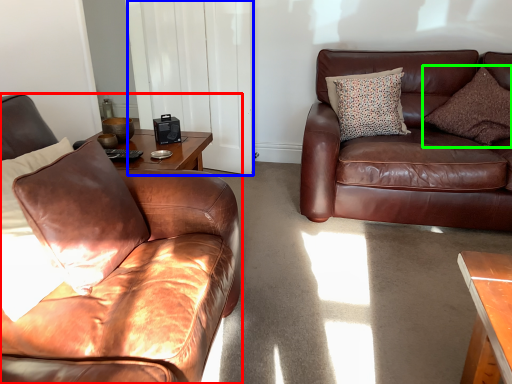
Question: Which is farther away from studio couch (highlighted by a red box)? glass door (highlighted by a blue box) or pillow (highlighted by a green box)?

Choices:
 (A) glass door
 (B) pillow

Answer: (B)